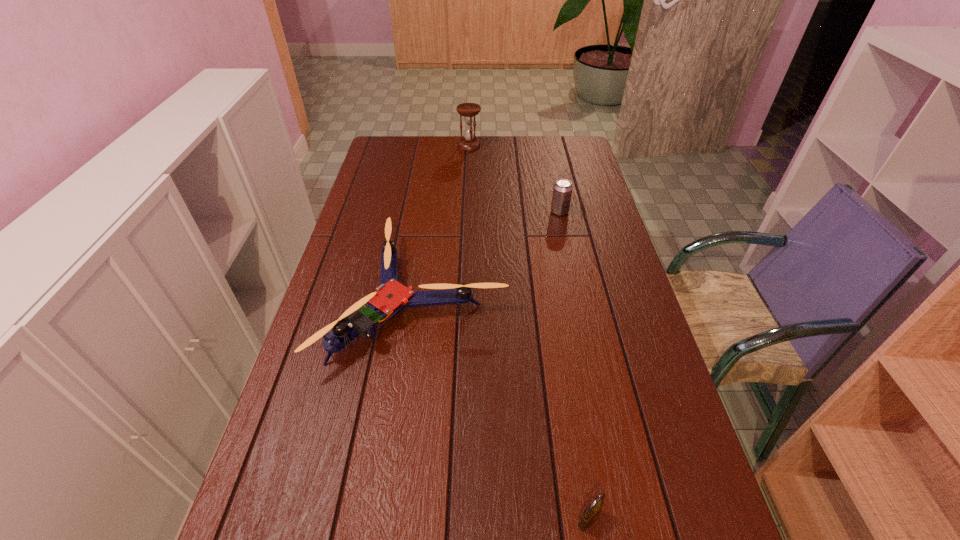
Identify the location of free space that satisfies the following two spatial constraints: 1. on the back side of the second nearest object; 2. on the left side of the beer can. Image resolution: width=960 pixels, height=540 pixels. (432, 212).